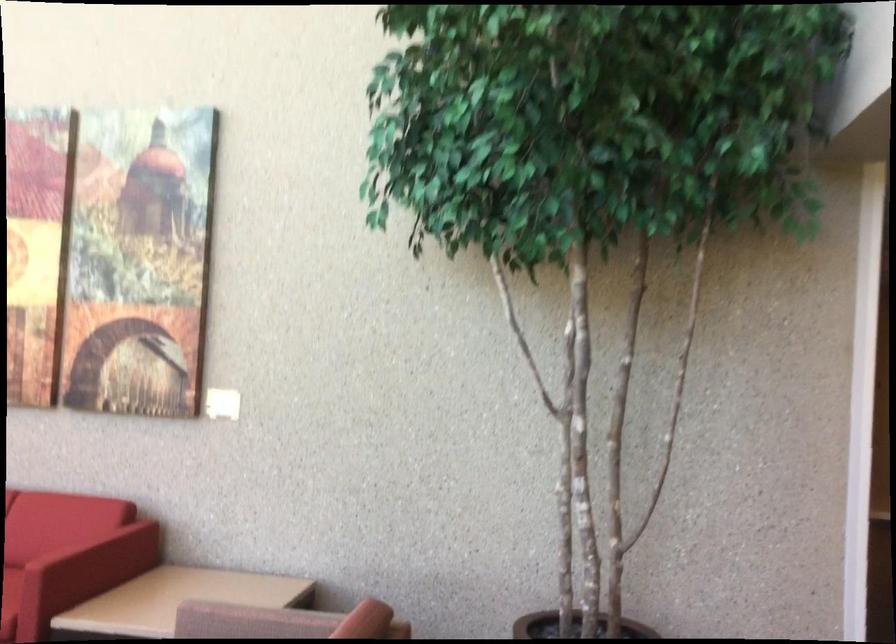
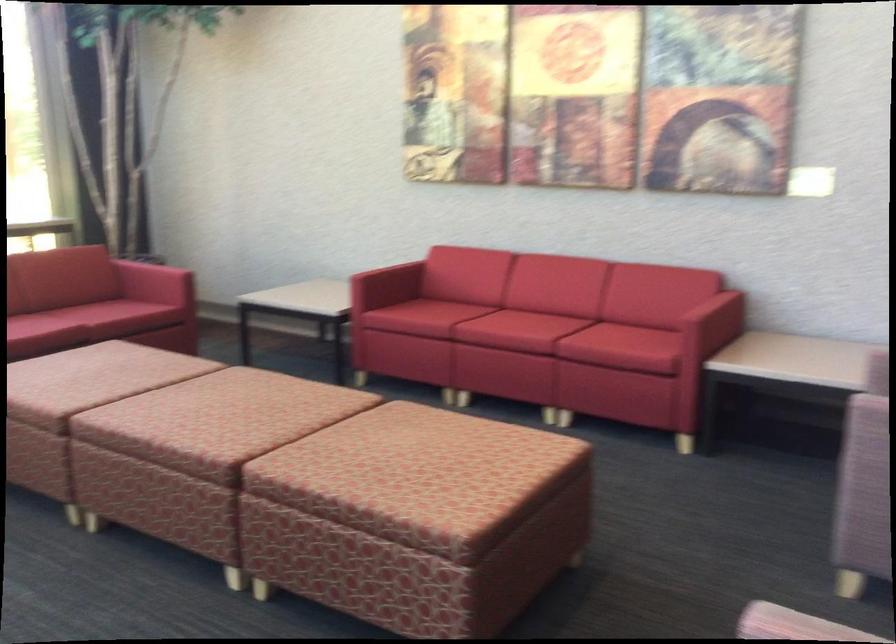
Question: What movement of the cameraman would produce the second image?

Choices:
 (A) Left
 (B) Right
 (C) Forward
 (D) Backward

Answer: (A)